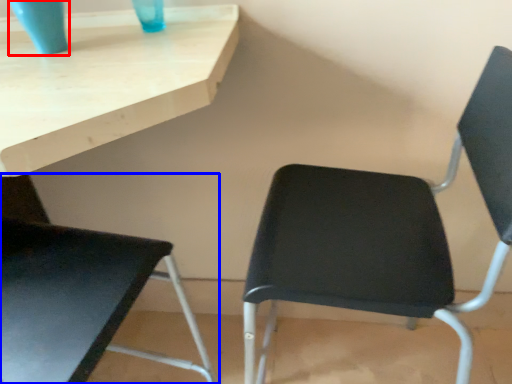
Question: Among these objects, which one is nearest to the camera, glass vase (highlighted by a red box) or chair (highlighted by a blue box)?

Choices:
 (A) glass vase
 (B) chair

Answer: (B)